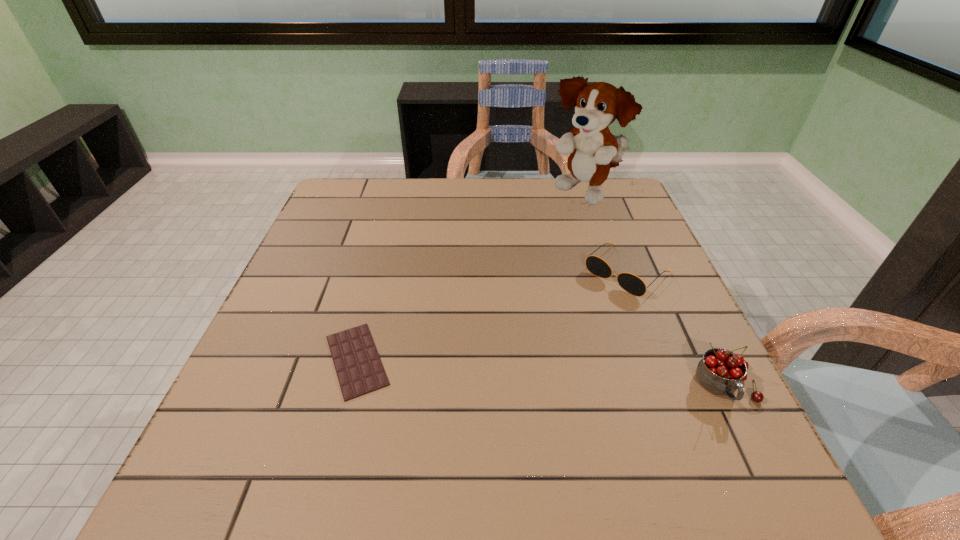
Identify the location of sunglasses that is at the right edge. The height and width of the screenshot is (540, 960). (631, 283).

Image resolution: width=960 pixels, height=540 pixels. I want to click on object that is at the near left corner, so click(359, 369).

Identify the location of object that is at the far right corner. Image resolution: width=960 pixels, height=540 pixels. (598, 105).

Locate an element on the screen. object that is positioned at the near right corner is located at coordinates (721, 372).

Locate an element on the screen. This screenshot has width=960, height=540. vacant space at the far edge of the desktop is located at coordinates (518, 204).

At what (x,y) coordinates should I click in order to perform the action: click on vacant space at the near edge of the desktop. Please return your answer as a coordinate pair (x, y). The image size is (960, 540). Looking at the image, I should click on (623, 429).

Find the location of a particular element. vacant space at the left edge of the desktop is located at coordinates (337, 229).

The width and height of the screenshot is (960, 540). What are the coordinates of `free region at the right edge` in the screenshot? It's located at point(593,246).

Where is `free region at the far left corner of the desktop`? The height and width of the screenshot is (540, 960). free region at the far left corner of the desktop is located at coordinates (341, 199).

Find the location of a particular element. The image size is (960, 540). blank area at the far right corner is located at coordinates (605, 199).